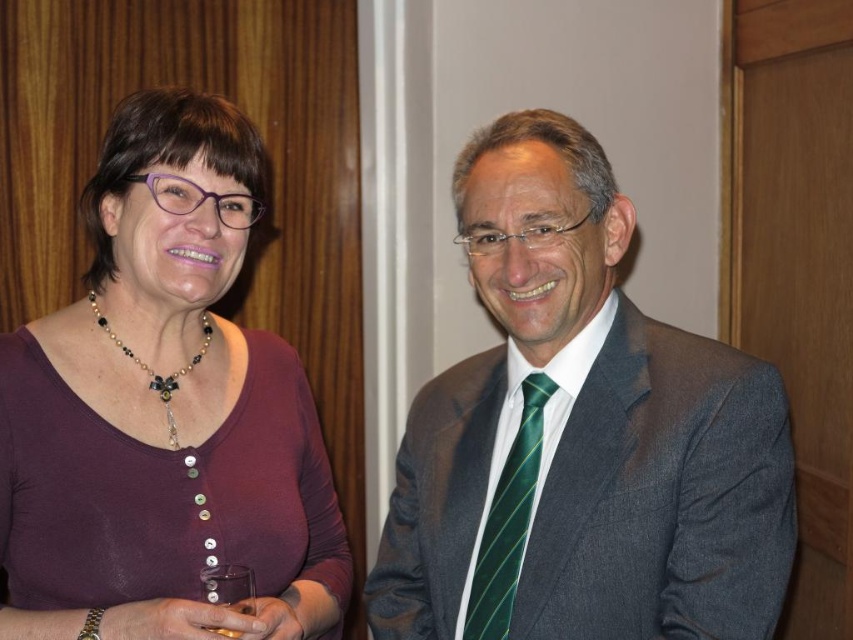
Is green striped tie at center positioned behind clear plastic cup at lower center?

Yes, it is behind clear plastic cup at lower center.

Between green striped tie at center and clear plastic cup at lower center, which one appears on the right side from the viewer's perspective?

green striped tie at center

Where is `green striped tie at center`? This screenshot has width=853, height=640. green striped tie at center is located at coordinates (508, 520).

Measure the distance between clear glass at lower left and camera.

clear glass at lower left and camera are 3.29 feet apart.

Who is positioned more to the left, clear glass at lower left or clear plastic cup at lower center?

clear glass at lower left

In order to click on clear glass at lower left in this screenshot , I will do `click(229, 586)`.

Image resolution: width=853 pixels, height=640 pixels. Identify the location of clear glass at lower left. (229, 586).

In the scene shown: Which is more to the right, dark gray suit at center or purple matte shirt at left?

From the viewer's perspective, dark gray suit at center appears more on the right side.

Which is behind, point (613, 433) or point (160, 378)?

The point (160, 378) is behind.

This screenshot has height=640, width=853. Identify the location of dark gray suit at center. (584, 435).